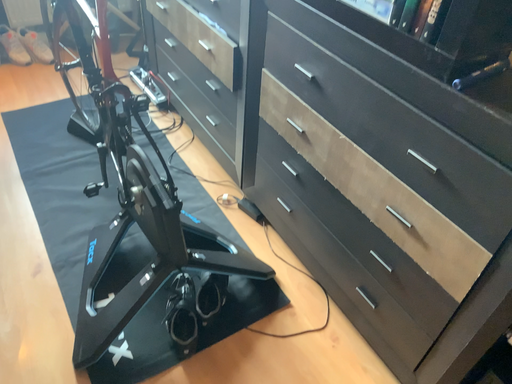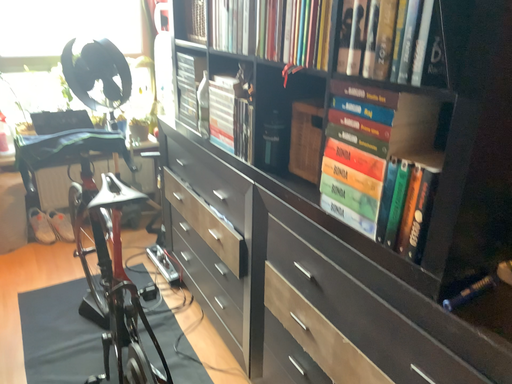
Question: Which way did the camera rotate in the video?

Choices:
 (A) rotated downward
 (B) rotated upward

Answer: (B)